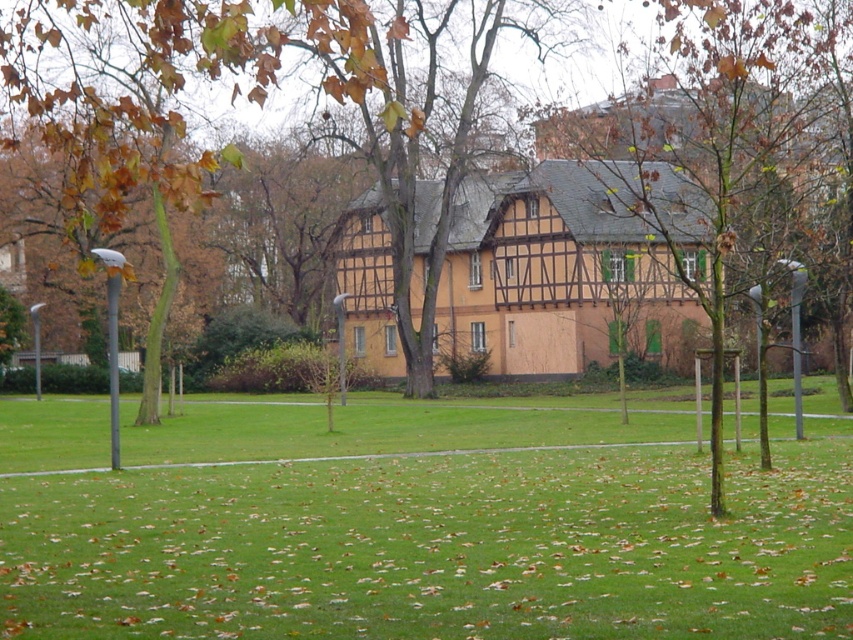
Question: Is green grass at center further to camera compared to brown textured tree at center?

Choices:
 (A) yes
 (B) no

Answer: (B)

Question: Which point appears farthest from the camera in this image?

Choices:
 (A) (786, 116)
 (B) (434, 518)

Answer: (A)

Question: Can you confirm if green grass at center is bigger than brown textured tree at center?

Choices:
 (A) no
 (B) yes

Answer: (A)

Question: Is green grass at center below brown textured tree at center?

Choices:
 (A) no
 (B) yes

Answer: (B)

Question: Which point is farther from the camera taking this photo?

Choices:
 (A) 244,492
 (B) 694,147

Answer: (B)